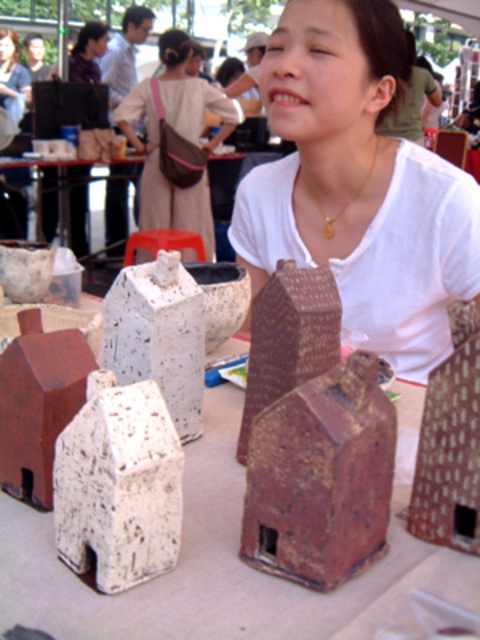
Question: Does matte white house at center have a smaller size compared to brown speckled clay houses at center?

Choices:
 (A) no
 (B) yes

Answer: (A)

Question: Which point appears farthest from the camera in this image?

Choices:
 (A) (394, 573)
 (B) (327, 220)
 (C) (182, 32)

Answer: (C)

Question: Which object appears closest to the camera in this image?

Choices:
 (A) brown speckled clay houses at center
 (B) matte white house at center
 (C) gold metallic necklace at center

Answer: (A)

Question: Does matte white house at center appear on the left side of brown speckled clay houses at center?

Choices:
 (A) no
 (B) yes

Answer: (A)

Question: Which point is farther to the camera?

Choices:
 (A) (191, 545)
 (B) (71, 70)
 (C) (180, 44)

Answer: (B)

Question: Is brown speckled clay houses at center to the left of matte brown bag at upper left from the viewer's perspective?

Choices:
 (A) yes
 (B) no

Answer: (B)